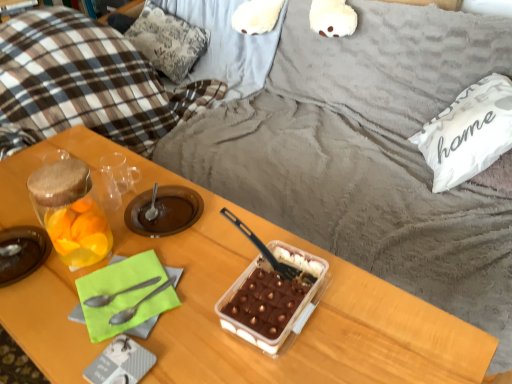
This screenshot has width=512, height=384. Find the location of `vacant region to the left of metallic silver spoon at lower left, the 3th spoon from the right`. vacant region to the left of metallic silver spoon at lower left, the 3th spoon from the right is located at coordinates (55, 298).